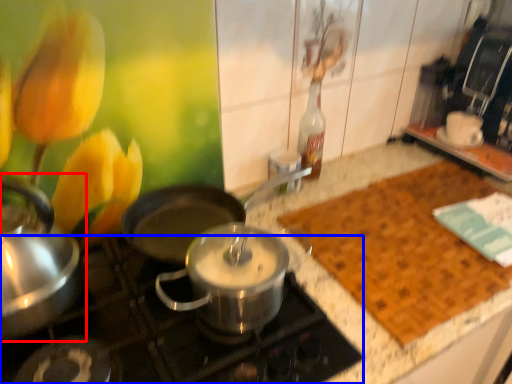
Question: Which object appears farthest to the camera in this image, kitchen appliance (highlighted by a red box) or gas stove (highlighted by a blue box)?

Choices:
 (A) kitchen appliance
 (B) gas stove

Answer: (A)